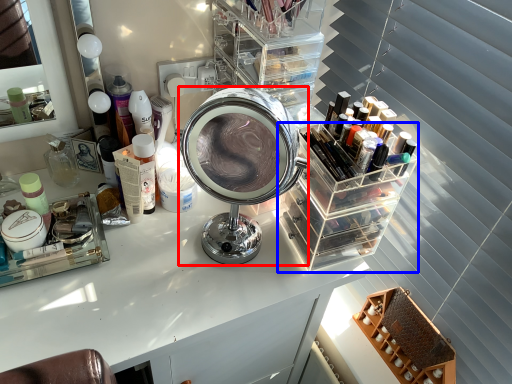
Question: Which point is further to the camera, scale (highlighted by a red box) or glass box (highlighted by a blue box)?

Choices:
 (A) scale
 (B) glass box

Answer: (B)